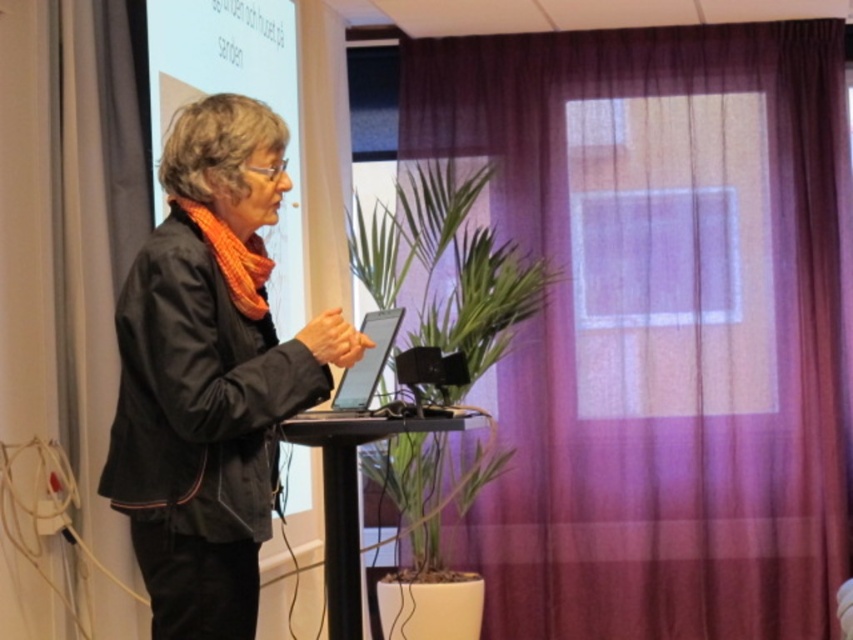
Question: Considering the real-world distances, which object is farthest from the black matte jacket at left?

Choices:
 (A) purple sheer curtain at center
 (B) orange knitted scarf at left
 (C) green leafy plant at center

Answer: (A)

Question: Is black matte jacket at left above orange knitted scarf at left?

Choices:
 (A) no
 (B) yes

Answer: (A)

Question: Is black matte jacket at left closer to the viewer compared to orange knitted scarf at left?

Choices:
 (A) yes
 (B) no

Answer: (A)

Question: Which point is farther from the camera taking this photo?

Choices:
 (A) (202, 220)
 (B) (734, 547)

Answer: (B)

Question: Which of the following is the closest to the observer?

Choices:
 (A) (676, 250)
 (B) (379, 244)

Answer: (B)

Question: Observing the image, what is the correct spatial positioning of green leafy plant at center in reference to orange knitted scarf at left?

Choices:
 (A) below
 (B) above

Answer: (A)